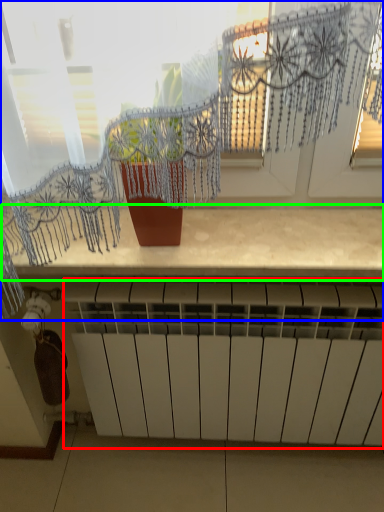
Question: Estimate the real-world distances between objects in this image. Which object is closer to radiator (highlighted by a red box), window (highlighted by a blue box) or counter top (highlighted by a green box)?

Choices:
 (A) window
 (B) counter top

Answer: (B)